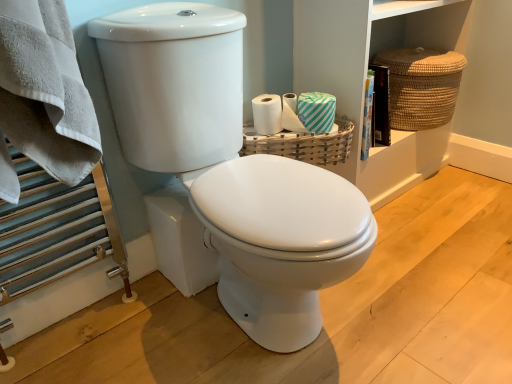
Identify the location of free point to the left of white glossy toilet at center, positioned as the first toilet in front-to-back order. This screenshot has width=512, height=384. (123, 335).